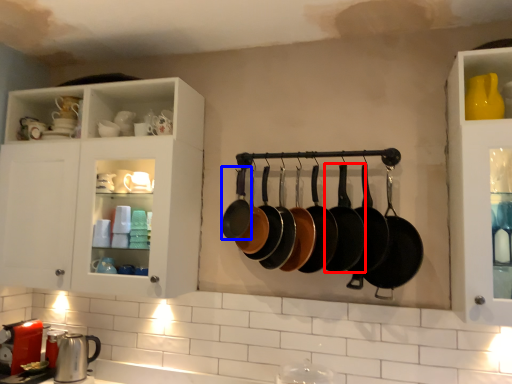
Question: Among these objects, which one is nearest to the camera, frying pan (highlighted by a red box) or frying pan (highlighted by a blue box)?

Choices:
 (A) frying pan
 (B) frying pan

Answer: (A)